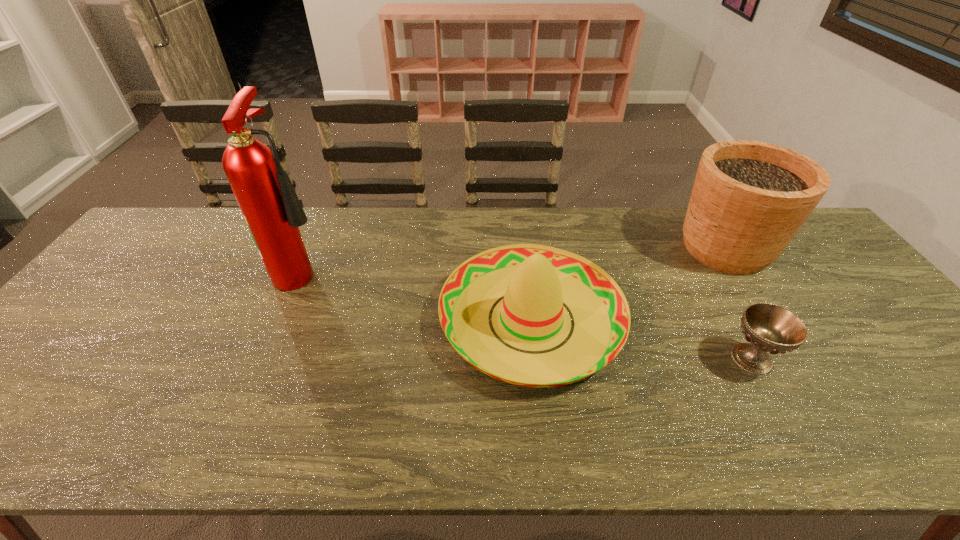
I want to click on free space between the second shortest object and the chalice, so click(641, 339).

At what (x,y) coordinates should I click in order to perform the action: click on empty space between the shortest object and the second shortest object. Please return your answer as a coordinate pair (x, y). The height and width of the screenshot is (540, 960). Looking at the image, I should click on (641, 339).

This screenshot has height=540, width=960. In order to click on empty space that is in between the third tallest object and the leftmost object in this screenshot , I will do `click(418, 294)`.

You are a GUI agent. You are given a task and a screenshot of the screen. Output one action in this format:
    pyautogui.click(x=<x>, y=<y>)
    Task: Click on the free spot between the leftmost object and the third tallest object
    
    Given the screenshot: What is the action you would take?
    pyautogui.click(x=418, y=294)

At what (x,y) coordinates should I click in order to perform the action: click on empty space that is in between the third object from right to left and the shortest object. Please return your answer as a coordinate pair (x, y). The width and height of the screenshot is (960, 540). Looking at the image, I should click on (641, 339).

Where is `vacant area that lies between the tallest object and the third tallest object`? The image size is (960, 540). vacant area that lies between the tallest object and the third tallest object is located at coordinates (418, 294).

Locate an element on the screen. This screenshot has width=960, height=540. object that ranks as the second closest to the second object from left to right is located at coordinates (x=749, y=199).

Select which object is the third closest to the third shortest object. Please provide its 2D coordinates. Your answer should be formatted as a tuple, i.e. [(x, y)], where the tuple contains the x and y coordinates of a point satisfying the conditions above.

[(270, 206)]

Where is `vacant space that satisfies the following two spatial constraints: 1. at the nozzle of the third object from right to left; 2. on the left side of the leftmost object`? The height and width of the screenshot is (540, 960). vacant space that satisfies the following two spatial constraints: 1. at the nozzle of the third object from right to left; 2. on the left side of the leftmost object is located at coordinates (282, 319).

You are a GUI agent. You are given a task and a screenshot of the screen. Output one action in this format:
    pyautogui.click(x=<x>, y=<y>)
    Task: Click on the vacant space that satisfies the following two spatial constraints: 1. on the back side of the flowerpot; 2. on the right side of the shortest object
    
    Given the screenshot: What is the action you would take?
    pyautogui.click(x=690, y=247)